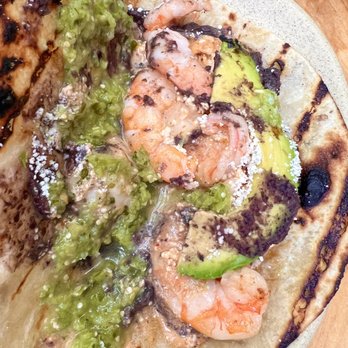
Locate an element on the screen. wooden surface is located at coordinates (325, 18).